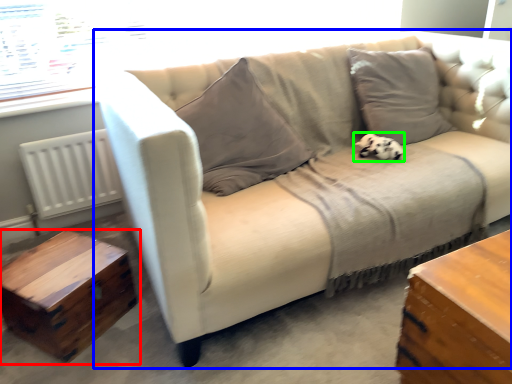
Question: Based on their relative distances, which object is farther from table (highlighted by a red box)? Choose from studio couch (highlighted by a blue box) and animal (highlighted by a green box).

Choices:
 (A) studio couch
 (B) animal

Answer: (B)